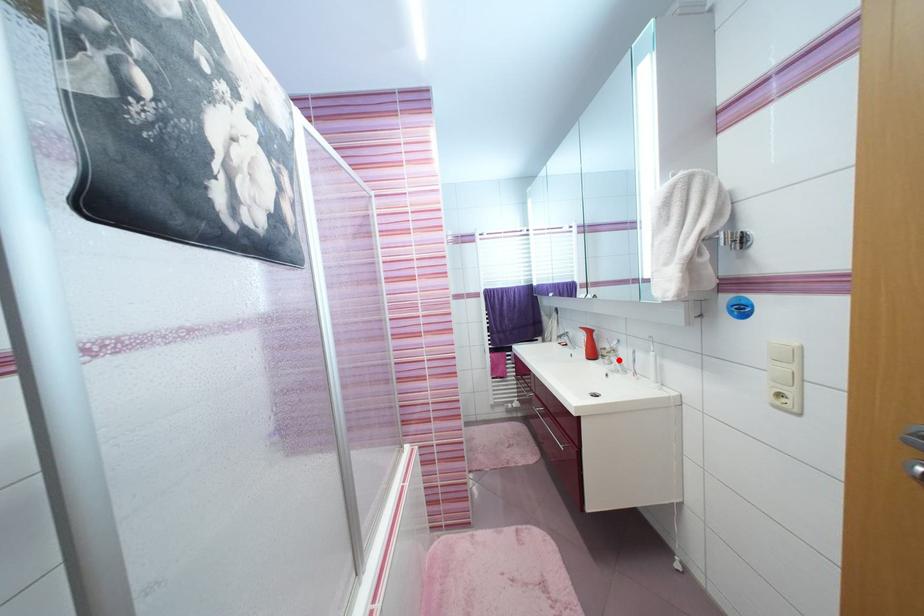
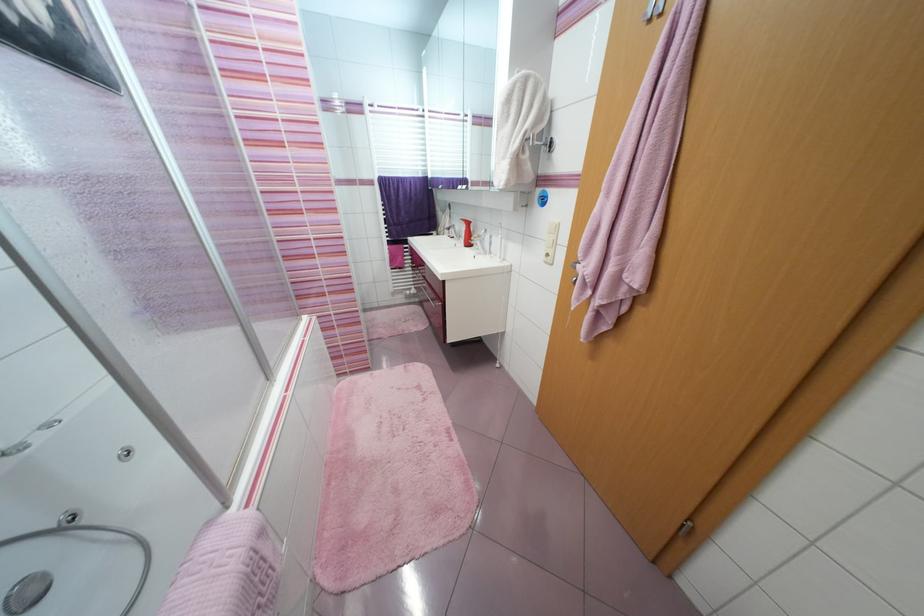
Find the pixel in the second image that matches the highlighted location in the first image.

(483, 244)